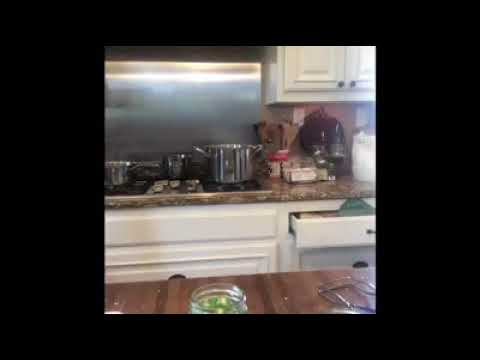
You are a GUI agent. You are given a task and a screenshot of the screen. Output one action in this format:
    pyautogui.click(x=<x>, y=<y>)
    Task: Click on the wooden spoon
    This screenshot has width=480, height=360.
    Given the screenshot: What is the action you would take?
    pyautogui.click(x=290, y=136)